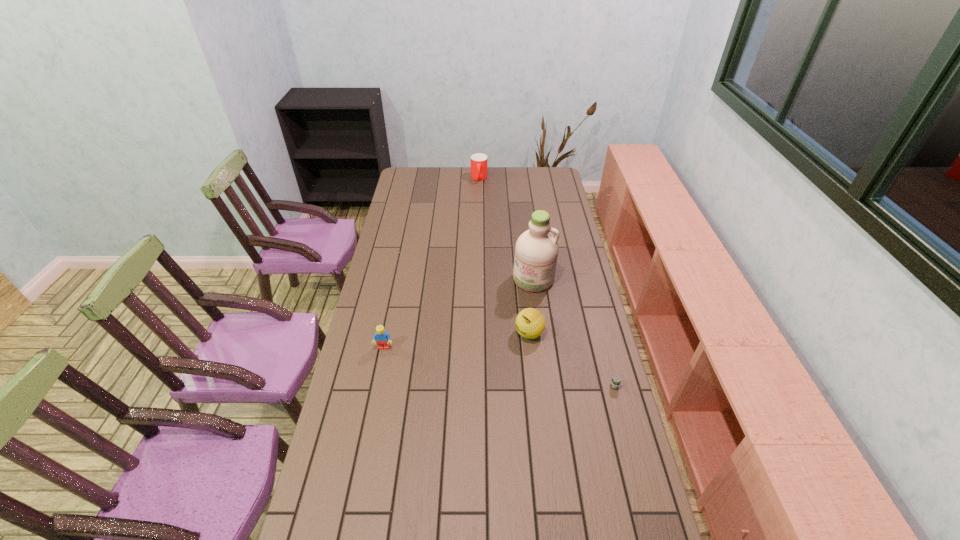
Where is `free space that satisfies the following two spatial constraints: 1. on the front side of the farthest object; 2. on the left side of the tallest object`? The height and width of the screenshot is (540, 960). free space that satisfies the following two spatial constraints: 1. on the front side of the farthest object; 2. on the left side of the tallest object is located at coordinates (479, 279).